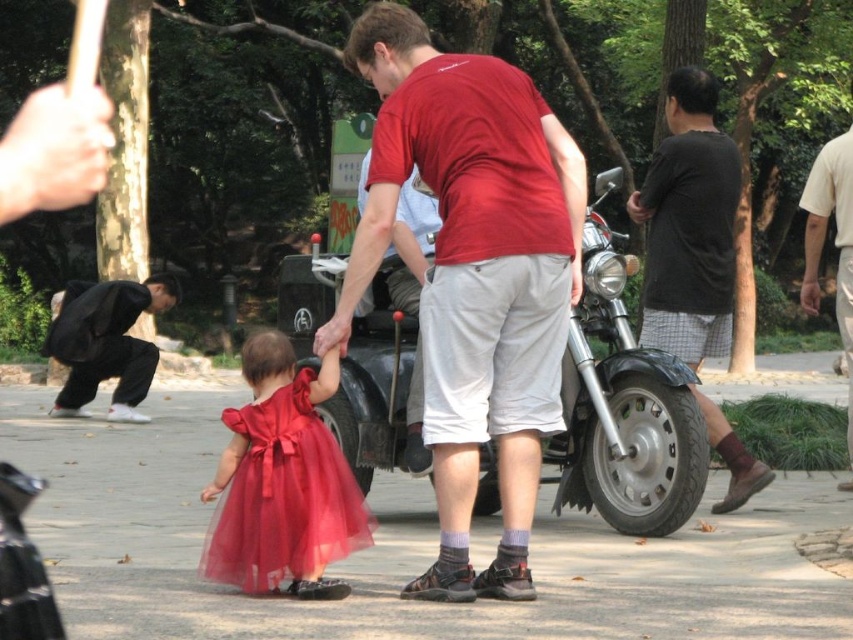
Which is in front, point (428, 356) or point (221, 456)?

Positioned in front is point (428, 356).

Is point (537, 288) positioned in front of point (263, 586)?

Yes.

Who is more distant from viewer, (x=442, y=403) or (x=341, y=548)?

The point (x=341, y=548) is more distant.

Locate an element on the screen. The height and width of the screenshot is (640, 853). matte red t-shirt at center is located at coordinates pos(473,275).

Between smooth concrete pavement at center and shiny metallic motorcycle at center, which one is positioned higher?

shiny metallic motorcycle at center is above.

Who is positioned more to the right, smooth concrete pavement at center or shiny metallic motorcycle at center?

Positioned to the right is shiny metallic motorcycle at center.

I want to click on smooth concrete pavement at center, so click(x=396, y=548).

Can you confirm if dark gray cotton shirt at right is positioned to the left of black cotton pants at left?

No, dark gray cotton shirt at right is not to the left of black cotton pants at left.

Is dark gray cotton shirt at right shorter than black cotton pants at left?

In fact, dark gray cotton shirt at right may be taller than black cotton pants at left.

Describe the element at coordinates (689, 225) in the screenshot. I see `dark gray cotton shirt at right` at that location.

What are the coordinates of `dark gray cotton shirt at right` in the screenshot? It's located at (689, 225).